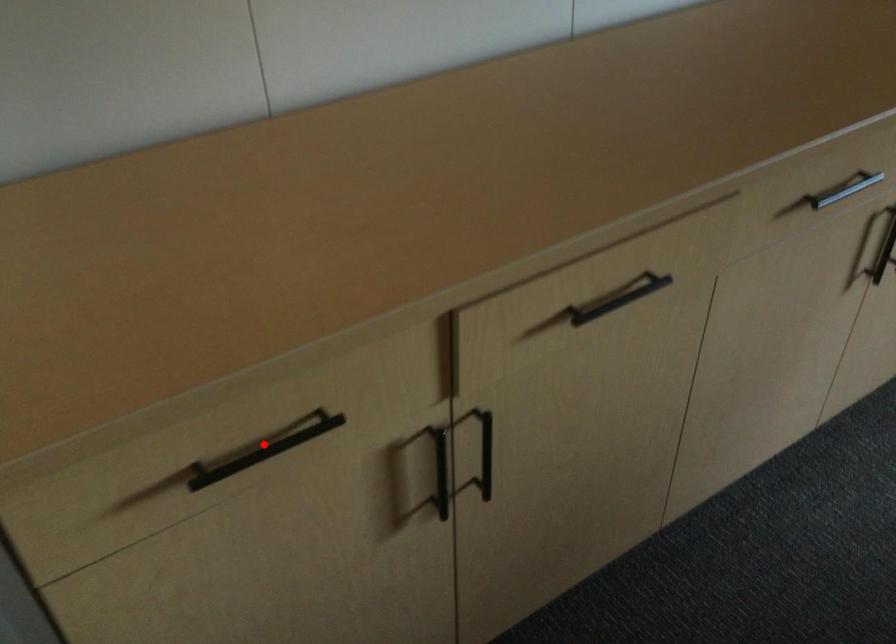
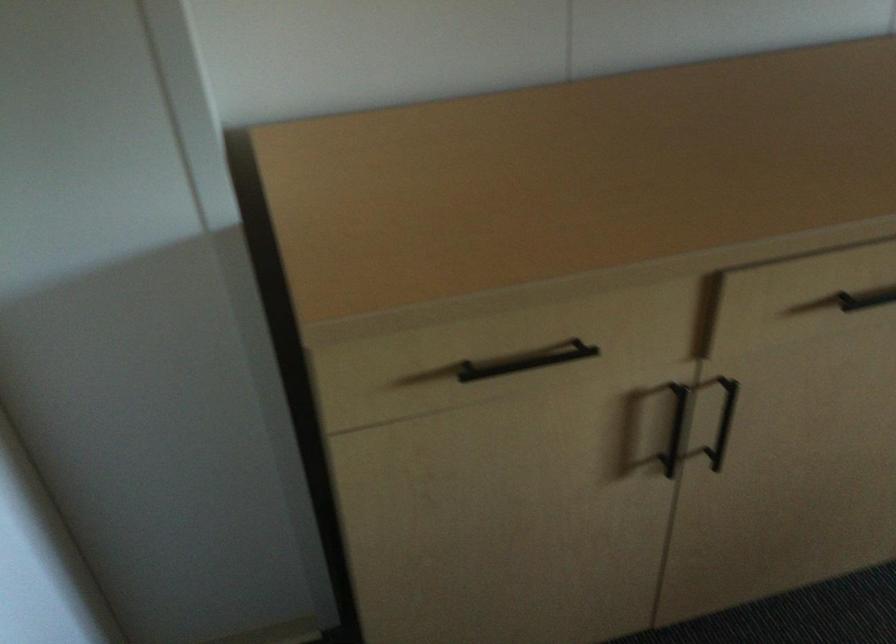
Question: I am providing you with two images of the same scene from different viewpoints. A red point is shown in image1. For the corresponding object point in image2, is it positioned nearer or farther from the camera?

Choices:
 (A) Nearer
 (B) Farther

Answer: (B)